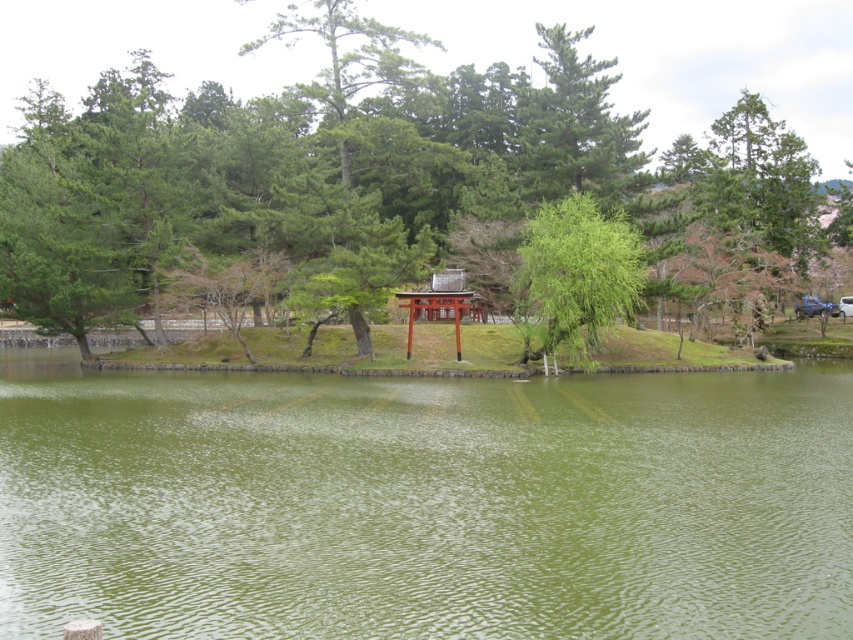
Question: Is green matte tree at center positioned in front of green leafy tree at center?

Choices:
 (A) yes
 (B) no

Answer: (B)

Question: Is green matte tree at center further to the viewer compared to shiny red wood torii gate at center?

Choices:
 (A) no
 (B) yes

Answer: (B)

Question: Which object appears closest to the camera in this image?

Choices:
 (A) green smooth water at center
 (B) green matte tree at center
 (C) shiny red wood torii gate at center

Answer: (A)

Question: Which point is farther from the camera taking this photo?

Choices:
 (A) (525, 284)
 (B) (782, 452)
 (C) (752, 83)

Answer: (C)

Question: Is green matte tree at center thinner than shiny red wood torii gate at center?

Choices:
 (A) no
 (B) yes

Answer: (A)

Question: Which object is the closest to the green matte tree at center?

Choices:
 (A) green leafy tree at center
 (B) green smooth water at center

Answer: (A)